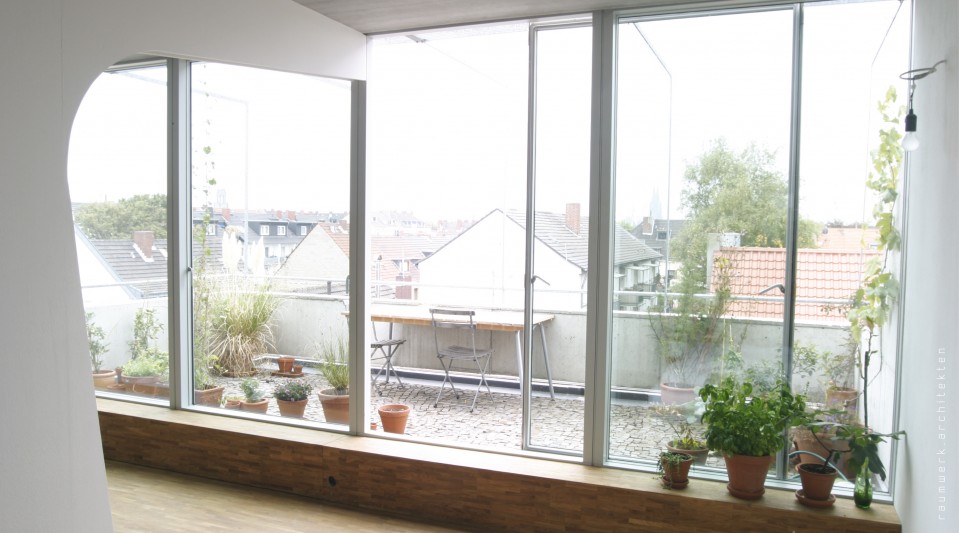
I want to click on handle, so click(356, 272), click(535, 274), click(770, 285).